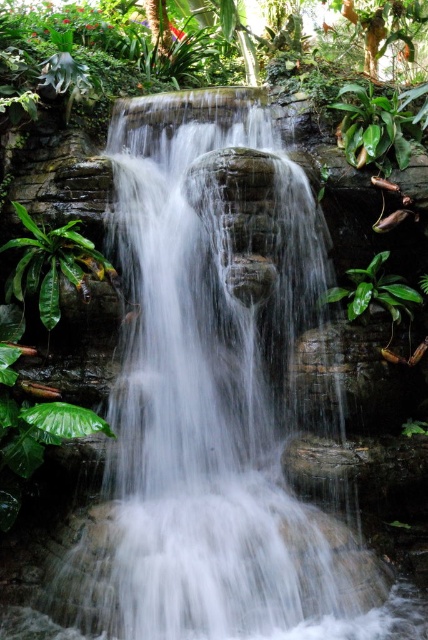
Question: Can you confirm if green leafy plant at left is wider than green glossy leaf at center right?

Choices:
 (A) yes
 (B) no

Answer: (A)

Question: Does green leafy plant at left appear under green glossy leaf at center right?

Choices:
 (A) no
 (B) yes

Answer: (A)

Question: Does green leafy plant at left appear over green glossy leaf at center right?

Choices:
 (A) yes
 (B) no

Answer: (A)

Question: Which of the following is the farthest from the observer?

Choices:
 (A) (350, 314)
 (B) (8, 243)

Answer: (A)

Question: Which point appears closest to the camera in this image?

Choices:
 (A) (17, 262)
 (B) (385, 308)

Answer: (A)

Question: Among these objects, which one is farthest from the camera?

Choices:
 (A) green glossy leaf at center right
 (B) green leafy plant at left

Answer: (A)